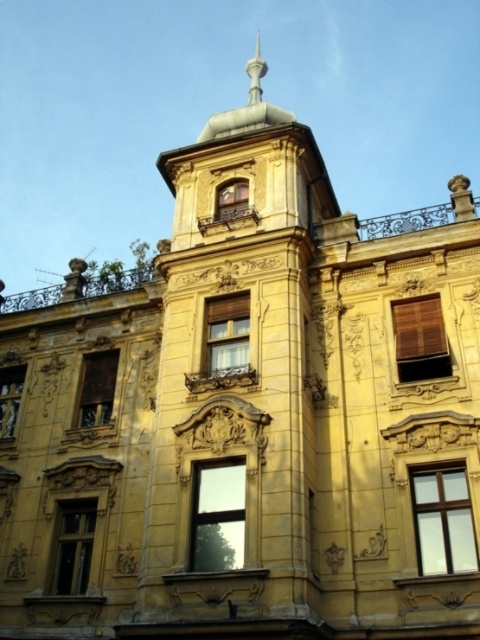
Looking at this image, which is more to the left, matte glass window at lower left or brown matte window at center-left?

brown matte window at center-left is more to the left.

This screenshot has height=640, width=480. Describe the element at coordinates (72, 547) in the screenshot. I see `matte glass window at lower left` at that location.

Find the location of `matte glass window at lower left`. matte glass window at lower left is located at coordinates (72, 547).

Describe the element at coordinates (443, 518) in the screenshot. I see `clear glass window at center` at that location.

At what (x,y) coordinates should I click in order to perform the action: click on clear glass window at center. Please return your answer as a coordinate pair (x, y). This screenshot has width=480, height=640. Looking at the image, I should click on (443, 518).

Is transparent glass window at center closer to camera compared to brown woven blinds at upper center?

That is True.

Does transparent glass window at center appear over brown woven blinds at upper center?

Incorrect, transparent glass window at center is not positioned above brown woven blinds at upper center.

Who is more distant from viewer, (228, 524) or (423, 314)?

The point (423, 314) is more distant.

Identify the location of transparent glass window at center. This screenshot has width=480, height=640. (218, 516).